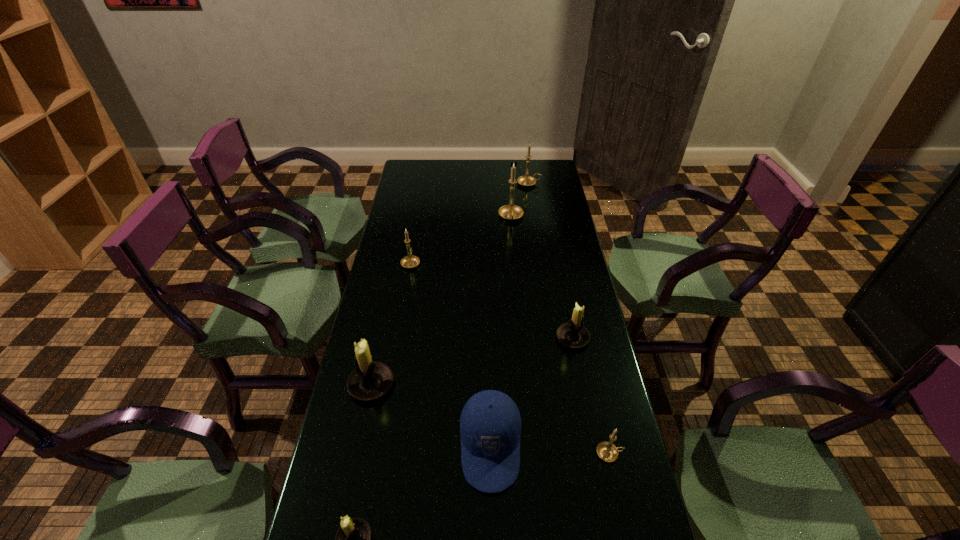
You are a GUI agent. You are given a task and a screenshot of the screen. Output one action in this format:
    pyautogui.click(x=<x>, y=<y>)
    Task: Click on the blue cap
    
    Given the screenshot: What is the action you would take?
    pyautogui.click(x=490, y=424)

The image size is (960, 540). I want to click on the sixth farthest candle holder, so click(x=606, y=451).

Find the location of `the smallest gold candle holder`. the smallest gold candle holder is located at coordinates (606, 451).

In order to click on vacant region located 0.130m on the handle side of the biggest gold candle holder in this screenshot , I will do `click(514, 247)`.

Locate an element on the screen. vacant space located on the back of the biggest white candle holder is located at coordinates (388, 304).

Image resolution: width=960 pixels, height=540 pixels. In order to click on blank space located 0.170m on the handle side of the third farthest object in this screenshot , I will do `click(417, 228)`.

This screenshot has height=540, width=960. I want to click on free space located on the handle side of the third farthest object, so click(x=421, y=200).

In order to click on vacant space situated 0.100m on the handle side of the third farthest object in this screenshot , I will do `click(415, 239)`.

The image size is (960, 540). In order to click on free space located 0.360m on the back of the farthest white candle holder in this screenshot , I will do `click(556, 254)`.

Identify the location of vacant space positioned 0.090m on the front-facing side of the cap. This screenshot has width=960, height=540. (492, 537).